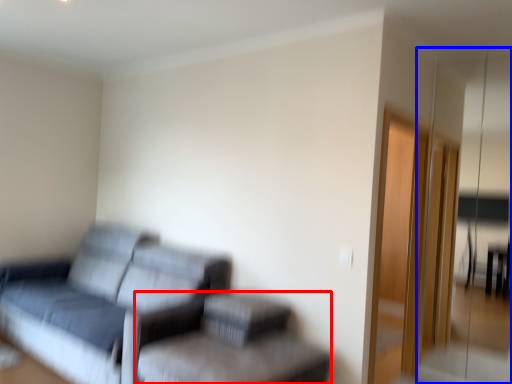
Question: Which object is closer to the camera taking this photo, swivel chair (highlighted by a red box) or glass door (highlighted by a blue box)?

Choices:
 (A) swivel chair
 (B) glass door

Answer: (A)